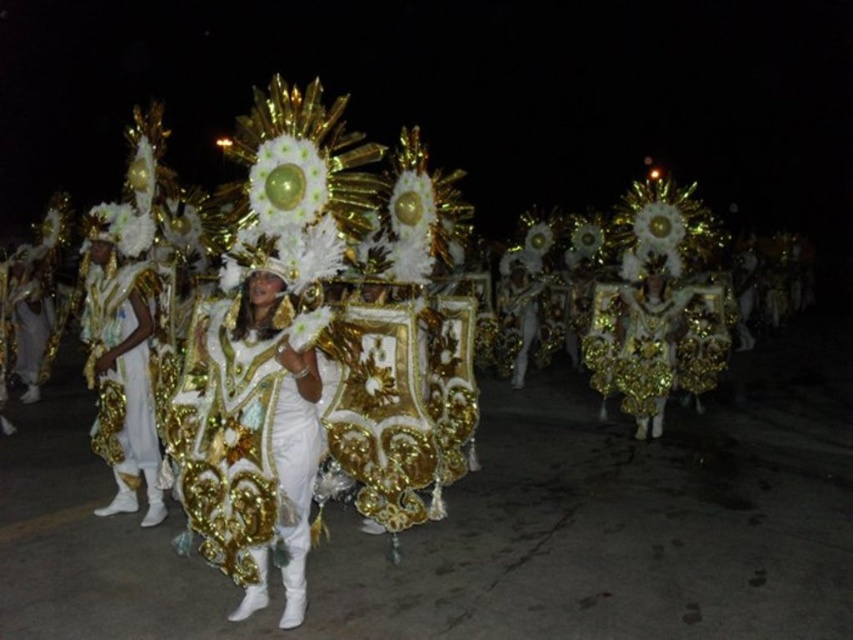
Can you confirm if white satin costume at center is taller than gold sequined costume at center?

Incorrect, white satin costume at center's height is not larger of gold sequined costume at center's.

Locate an element on the screen. The width and height of the screenshot is (853, 640). white satin costume at center is located at coordinates (242, 433).

Does white satin headdress at center have a lesser height compared to gold sequined costume at center?

Correct, white satin headdress at center is not as tall as gold sequined costume at center.

This screenshot has width=853, height=640. What are the coordinates of `white satin headdress at center` in the screenshot? It's located at (122, 369).

Is white satin costume at center shorter than white satin headdress at center?

Yes, white satin costume at center is shorter than white satin headdress at center.

Is white satin costume at center thinner than white satin headdress at center?

In fact, white satin costume at center might be wider than white satin headdress at center.

At what (x,y) coordinates should I click in order to perform the action: click on white satin costume at center. Please return your answer as a coordinate pair (x, y). This screenshot has height=640, width=853. Looking at the image, I should click on (242, 433).